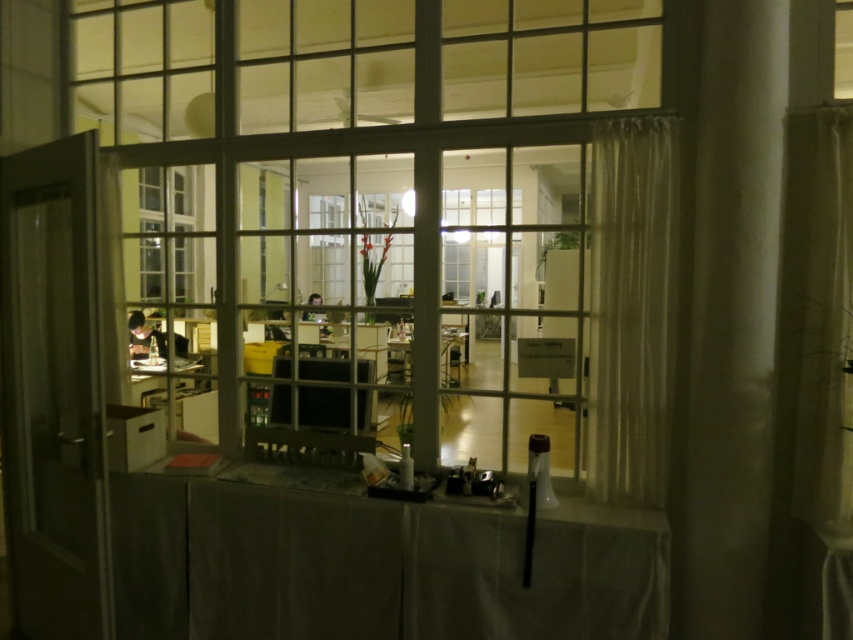
Does point (264, 77) lie in front of point (440, 369)?

No, it is not.

Can you confirm if clear glass window at center is positioned above matte wooden table at center?

Indeed, clear glass window at center is positioned over matte wooden table at center.

Measure the distance between clear glass window at center and camera.

They are 7.85 feet apart.

Identify the location of clear glass window at center. (407, 204).

Does point (640, 58) come behind point (641, 381)?

Yes, point (640, 58) is farther from viewer.

Between clear glass window at center and sheer white curtain at right, which one has more height?

clear glass window at center is taller.

What do you see at coordinates (407, 204) in the screenshot? Image resolution: width=853 pixels, height=640 pixels. I see `clear glass window at center` at bounding box center [407, 204].

This screenshot has height=640, width=853. What are the coordinates of `clear glass window at center` in the screenshot? It's located at (407, 204).

Is point (579, 556) closer to viewer compared to point (408, 378)?

Yes, it is.

Can you confirm if smooth gray table at center is smaller than matte wooden table at center?

No, smooth gray table at center is not smaller than matte wooden table at center.

Does point (582, 577) come behind point (393, 339)?

No, (582, 577) is closer to viewer.

Locate an element on the screen. This screenshot has width=853, height=640. smooth gray table at center is located at coordinates (374, 564).